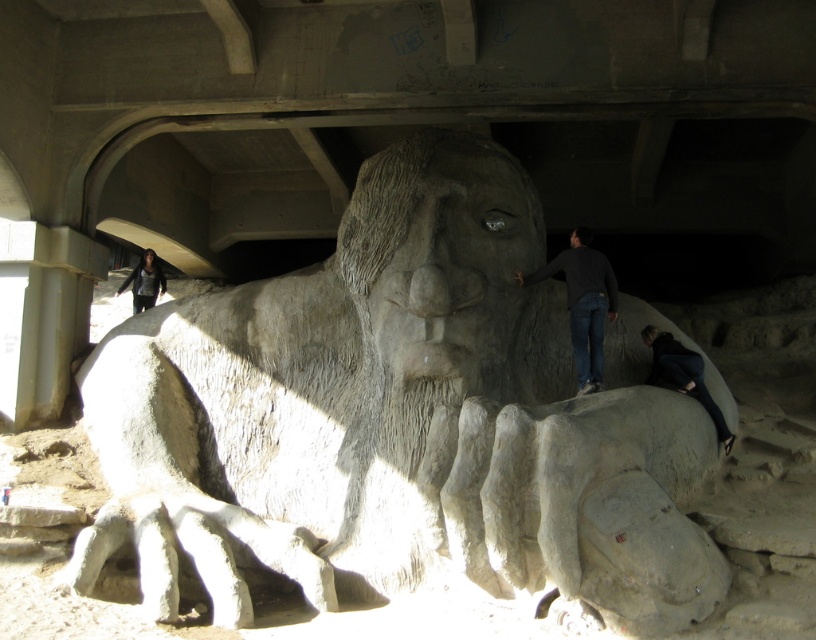
Question: Is dark gray sweater at upper right further to the viewer compared to dark gray sweater at lower left?

Choices:
 (A) yes
 (B) no

Answer: (B)

Question: Is black fabric pants at lower right wider than dark gray sweater at lower left?

Choices:
 (A) yes
 (B) no

Answer: (A)

Question: Estimate the real-world distances between objects in this image. Which object is farther from the dark gray sweater at lower left?

Choices:
 (A) gray stone statue at center
 (B) black fabric pants at lower right

Answer: (B)

Question: Which object is farther from the camera taking this photo?

Choices:
 (A) dark gray sweater at lower left
 (B) dark gray sweater at upper right
 (C) black fabric pants at lower right

Answer: (A)

Question: Which point appears farthest from the camera in this image?

Choices:
 (A) (655, 346)
 (B) (626, 332)

Answer: (B)

Question: Does dark gray sweater at upper right appear on the right side of black fabric pants at lower right?

Choices:
 (A) no
 (B) yes

Answer: (A)